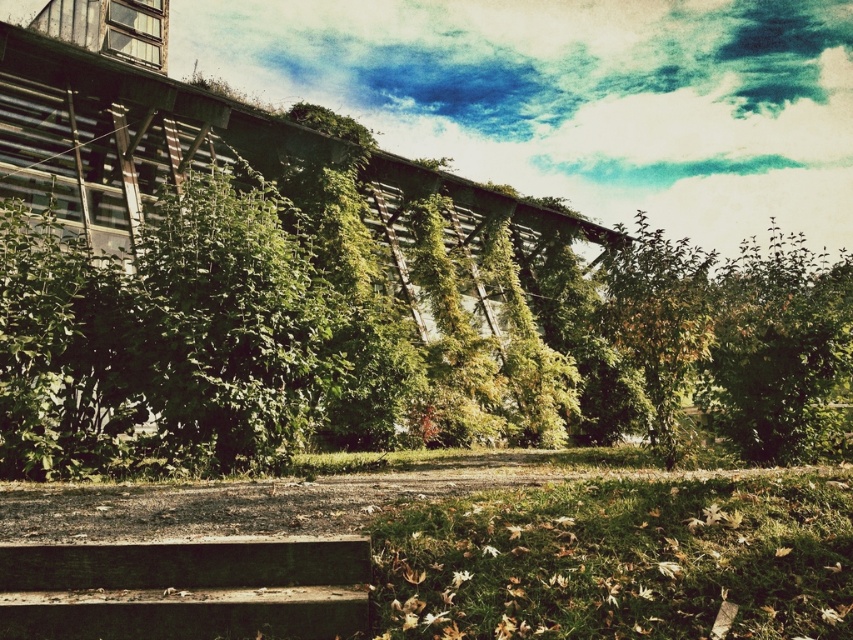
Is dark brown wooden stairs at lower center to the left of green leafy tree at right from the viewer's perspective?

Yes, dark brown wooden stairs at lower center is to the left of green leafy tree at right.

Consider the image. Can you confirm if dark brown wooden stairs at lower center is wider than green leafy tree at right?

No.

Is point (44, 637) closer to camera compared to point (743, 381)?

Yes, point (44, 637) is closer to viewer.

Where is `dark brown wooden stairs at lower center`? dark brown wooden stairs at lower center is located at coordinates pos(184,589).